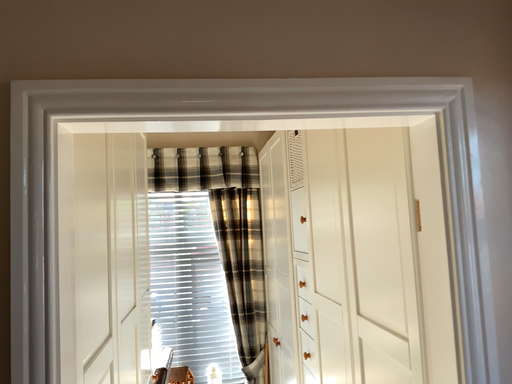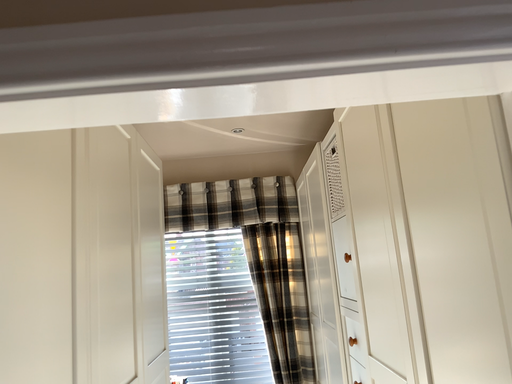
Question: Which way did the camera rotate in the video?

Choices:
 (A) rotated left
 (B) rotated right

Answer: (A)